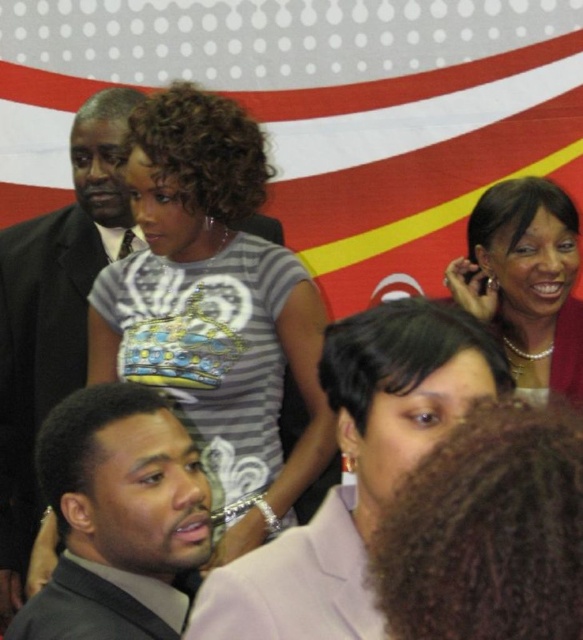
You are organizing a photo shoot and need to place a small podium for a speaker. The podium will be placed at coordinate point 0.811, 0.206. There is a dark gray suit at lower left at that position. Is there enough space to place the podium there?

The dark gray suit at lower left is located at point (120, 518), so placing the podium there would interfere with the existing dark gray suit at lower left. Choose a different location.

You are standing at the point marked as point (48,451) and want to take a photo of the banner with the red, white, and yellow stripes. The camera you are using has a maximum focus range of 5 feet. Will the camera be able to focus on the banner?

The point (48,451) and camera are 5.11 feet apart from each other. Since the maximum focus range is 5 feet, the camera cannot focus on the banner because the distance exceeds the limit.

You are a photographer standing in the scene and want to take a photo of the dark gray suit at lower left. Considering your position, can you estimate how far you need to move forward to ensure the suit fills the frame properly? Assume your camera has a standard lens with a focal length that requires being 1 meter away for optimal framing.

The dark gray suit at lower left is currently 1.42 meters away from you. Since the optimal distance for framing is 1 meter, you need to move forward by approximately 0.42 meters to achieve the desired composition.